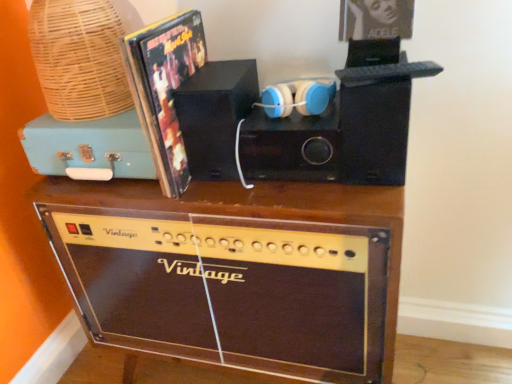
You are a GUI agent. You are given a task and a screenshot of the screen. Output one action in this format:
    pyautogui.click(x=<x>, y=<y>)
    Task: Click on the free space in front of black matte speaker at center, the 2th speaker viewed from the right
    The width and height of the screenshot is (512, 384).
    Given the screenshot: What is the action you would take?
    pyautogui.click(x=256, y=189)